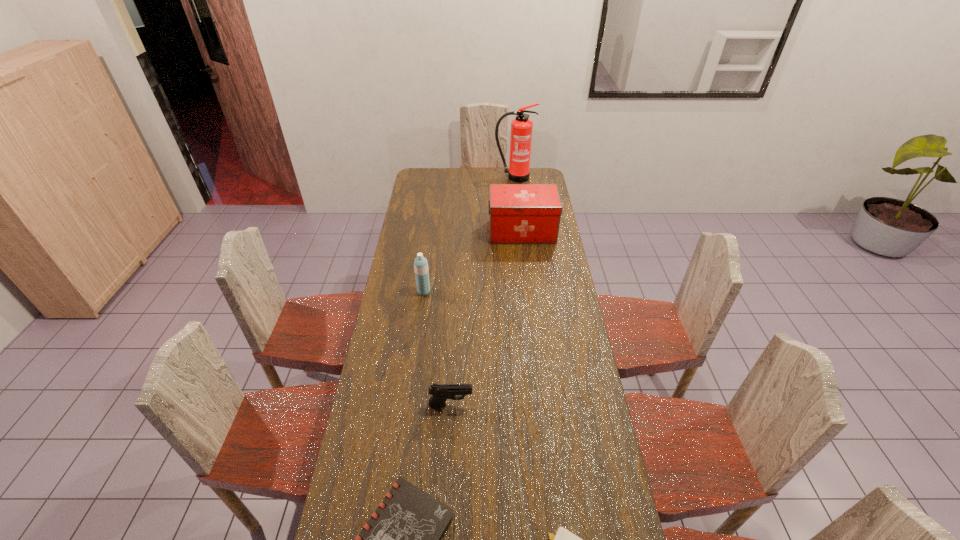
Find the location of a particular element. The width and height of the screenshot is (960, 540). blank space located 0.370m on the right of the fourth nearest object is located at coordinates (516, 292).

Locate an element on the screen. Image resolution: width=960 pixels, height=540 pixels. free space located at the barrel of the third nearest object is located at coordinates (514, 404).

You are a GUI agent. You are given a task and a screenshot of the screen. Output one action in this format:
    pyautogui.click(x=<x>, y=<y>)
    Task: Click on the object at the far edge
    This screenshot has width=960, height=540.
    Given the screenshot: What is the action you would take?
    pyautogui.click(x=521, y=127)

Image resolution: width=960 pixels, height=540 pixels. Find the location of `object present at the left edge`. object present at the left edge is located at coordinates (420, 264).

Locate an element on the screen. The height and width of the screenshot is (540, 960). fire extinguisher present at the right edge is located at coordinates (521, 127).

Locate an element on the screen. The height and width of the screenshot is (540, 960). the first-aid kit present at the right edge is located at coordinates (518, 213).

Identify the location of object present at the far right corner. (521, 127).

Locate an element on the screen. This screenshot has height=540, width=960. free space at the far edge is located at coordinates (470, 181).

What are the coordinates of `vacant space at the left edge of the desktop` in the screenshot? It's located at (339, 507).

Where is `free space at the right edge of the desktop`? The image size is (960, 540). free space at the right edge of the desktop is located at coordinates (546, 269).